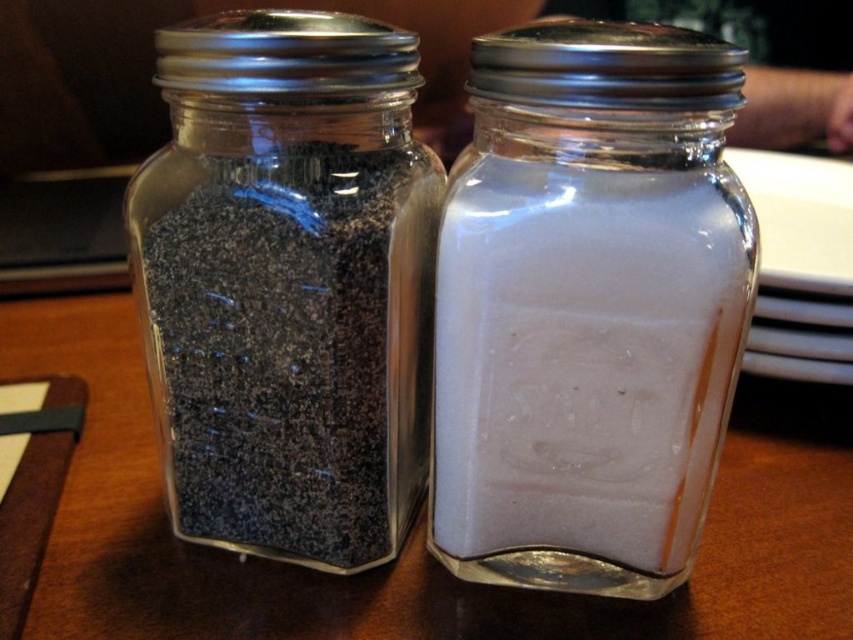
The height and width of the screenshot is (640, 853). What do you see at coordinates (589, 307) in the screenshot?
I see `white glass salt shaker at center` at bounding box center [589, 307].

Can you confirm if white glass salt shaker at center is positioned to the left of matte black pepper at left?

Incorrect, white glass salt shaker at center is not on the left side of matte black pepper at left.

Is point (601, 483) less distant than point (387, 125)?

No.

Where is `white glass salt shaker at center`? white glass salt shaker at center is located at coordinates (589, 307).